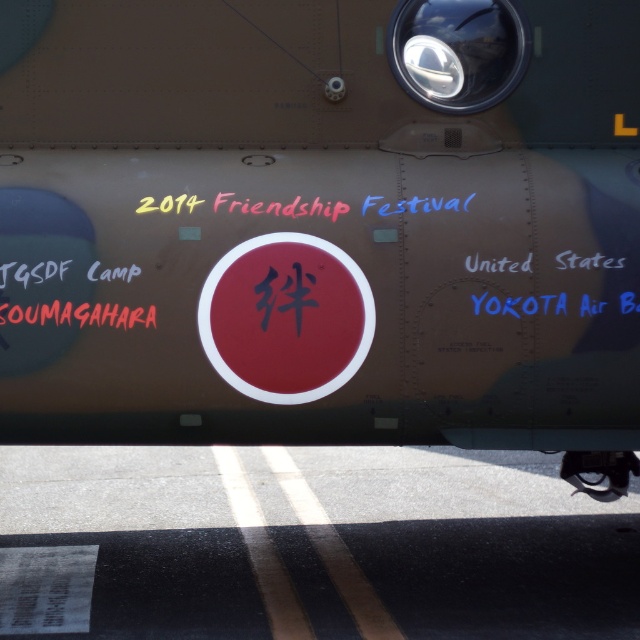
Looking at this image, you are a photographer trying to capture the entire scene of the military aircraft in one shot. Given that the black asphalt at lower center and the metallic silver cockpit at upper center are both in the frame, which object should you focus on to ensure the other remains in the background?

You should focus on the metallic silver cockpit at upper center because the black asphalt at lower center is wider and will stay in the background.

You are standing at the point marked as point (317, 541) on the aircraft. Looking around, you see the black asphalt at lower center. What surface are you currently standing on?

You are standing on the black asphalt at lower center because the point (317, 541) is located on it.